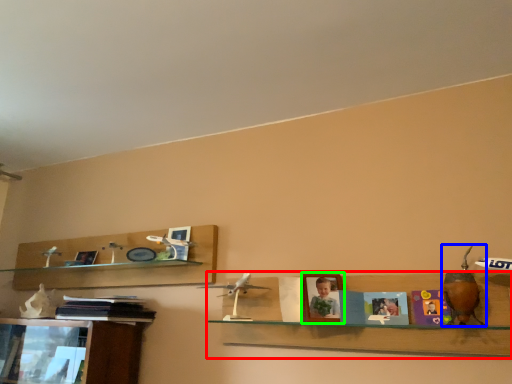
Question: Which object is positioned farthest from shelf (highlighted by a red box)? Select from toy (highlighted by a blue box) and picture frame (highlighted by a green box).

Choices:
 (A) toy
 (B) picture frame

Answer: (A)